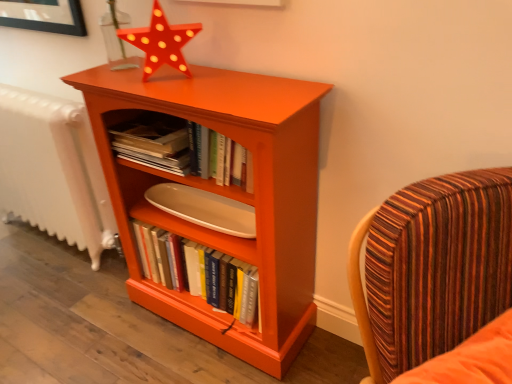
Locate an element on the screen. vacant space situated above orange matte wood bookcase at center (from a real-world perspective) is located at coordinates (198, 84).